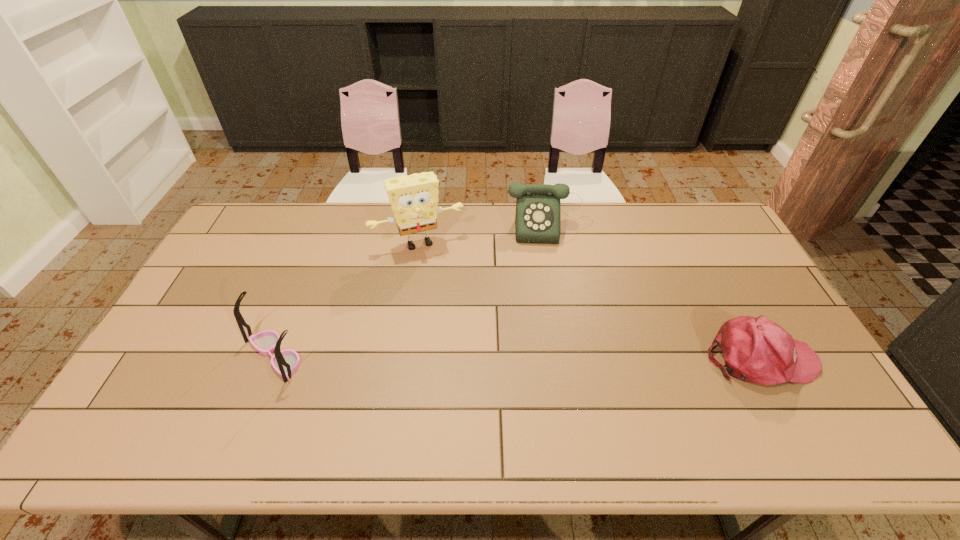
Where is `vacant area between the telephone and the sponge`? vacant area between the telephone and the sponge is located at coordinates (485, 234).

The height and width of the screenshot is (540, 960). I want to click on free spot between the third object from left to right and the spectacles, so pos(413,291).

Image resolution: width=960 pixels, height=540 pixels. Identify the location of vacant area that lies between the shortest object and the telephone. (656, 292).

Locate an element on the screen. unoccupied position between the telephone and the rightmost object is located at coordinates (656, 292).

This screenshot has height=540, width=960. Find the location of `object that ranks as the second closest to the rightmost object`. object that ranks as the second closest to the rightmost object is located at coordinates (414, 199).

Select which object appears as the third closest to the second object from right to left. Please provide its 2D coordinates. Your answer should be formatted as a tuple, i.e. [(x, y)], where the tuple contains the x and y coordinates of a point satisfying the conditions above.

[(286, 362)]

This screenshot has height=540, width=960. I want to click on free point that satisfies the following two spatial constraints: 1. on the back side of the tallest object; 2. on the left side of the telephone, so click(x=421, y=226).

This screenshot has height=540, width=960. I want to click on blank space that satisfies the following two spatial constraints: 1. on the back side of the second object from left to right; 2. on the right side of the spectacles, so click(x=320, y=242).

I want to click on vacant point that satisfies the following two spatial constraints: 1. on the front side of the baseball cap; 2. at the front of the second object from right to left with the brim, so click(x=575, y=357).